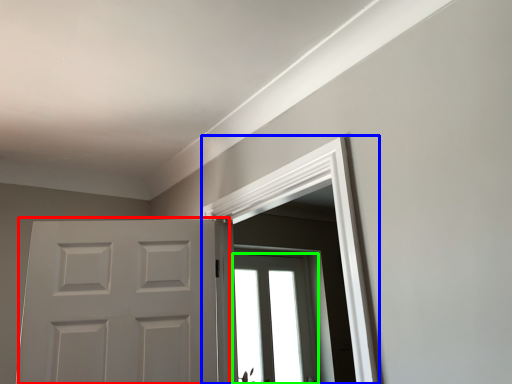
Question: Which object is positioned closest to door (highlighted by a red box)? Select from window frame (highlighted by a blue box) and window (highlighted by a green box).

Choices:
 (A) window frame
 (B) window

Answer: (A)